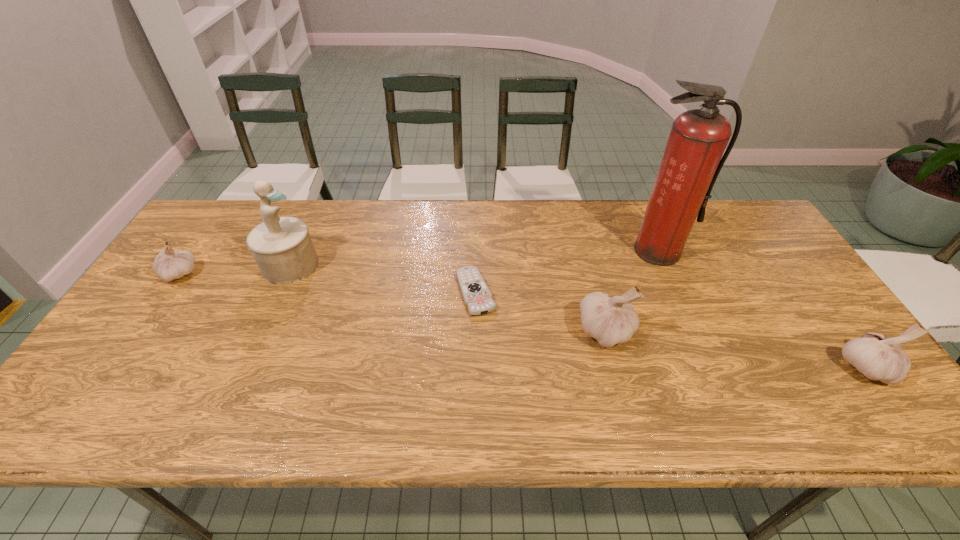
This screenshot has height=540, width=960. I want to click on fire extinguisher, so click(692, 160).

Find the location of a particular element. Image resolution: width=960 pixels, height=540 pixels. free space located on the right of the leftmost object is located at coordinates (317, 274).

At what (x,y) coordinates should I click in order to perform the action: click on free space located 0.310m on the left of the second garlic from left to right. Please return your answer as a coordinate pair (x, y). This screenshot has height=540, width=960. Looking at the image, I should click on (456, 332).

At what (x,y) coordinates should I click in order to perform the action: click on free space located 0.210m on the left of the rightmost object. Please return your answer as a coordinate pair (x, y). Looking at the image, I should click on (749, 367).

The image size is (960, 540). In order to click on vacant space located 0.240m on the left of the shortest object in this screenshot , I will do `click(368, 292)`.

Find the location of a particular element. Image resolution: width=960 pixels, height=540 pixels. vacant region located 0.380m at the beak of the figurine is located at coordinates (447, 265).

The image size is (960, 540). Identify the location of vacant point located 0.220m at the nozzle of the second object from right to left. (x=690, y=325).

This screenshot has width=960, height=540. What are the coordinates of `object located at the far edge` in the screenshot? It's located at pyautogui.click(x=692, y=160).

This screenshot has height=540, width=960. In order to click on object positioned at the near edge in this screenshot , I will do `click(877, 357)`.

Locate an element on the screen. The image size is (960, 540). object at the left edge is located at coordinates (169, 264).